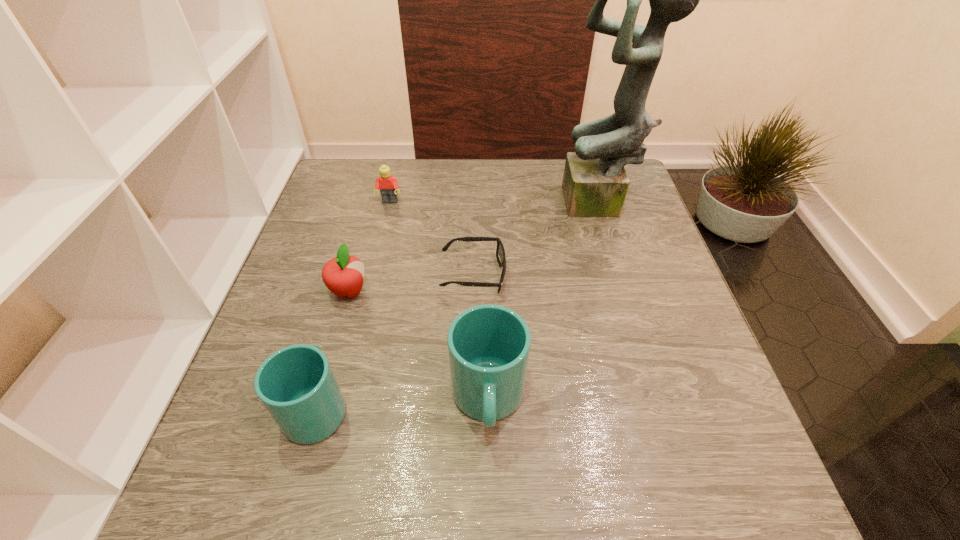
Identify the location of free region located on the handle side of the left cup. (333, 349).

In order to click on vacant space situated on the handle side of the left cup in this screenshot , I will do `click(340, 326)`.

The width and height of the screenshot is (960, 540). Find the location of `vacant region located 0.270m on the face of the Lego`. vacant region located 0.270m on the face of the Lego is located at coordinates (372, 276).

You are a GUI agent. You are given a task and a screenshot of the screen. Output one action in this format:
    pyautogui.click(x=<x>, y=<y>)
    Task: Click on the vacant area located 0.340m on the face of the sculpture
    The width and height of the screenshot is (960, 540).
    Given the screenshot: What is the action you would take?
    440,206

Identify the location of vacant area located 0.200m on the face of the sculpture. (491, 206).

Find the location of `free space located on the face of the sculpture`. free space located on the face of the sculpture is located at coordinates (451, 206).

The image size is (960, 540). Identify the location of vacant space located on the front of the apple. (336, 336).

At what (x,y) coordinates should I click in order to perform the action: click on vacant space located on the front-facing side of the shortest object. Please return your answer as a coordinate pair (x, y). This screenshot has height=540, width=960. Looking at the image, I should click on (667, 274).

This screenshot has height=540, width=960. I want to click on Lego present at the far edge, so click(x=388, y=185).

Where is `sculpture located at the far edge`? This screenshot has width=960, height=540. sculpture located at the far edge is located at coordinates (595, 183).